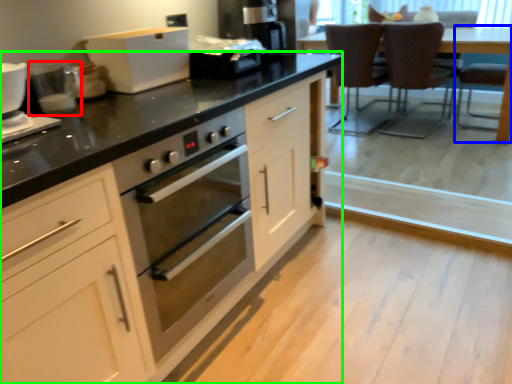
Question: Which object is positioned farthest from kitchen appliance (highlighted by a red box)? Select from armchair (highlighted by a blue box) and cabinetry (highlighted by a green box).

Choices:
 (A) armchair
 (B) cabinetry

Answer: (A)